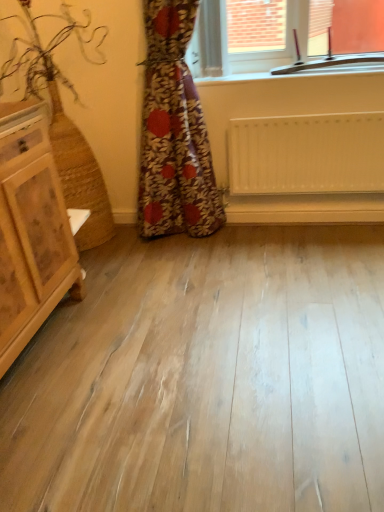
Question: Do you think floral fabric curtain at center is within clear glass window at upper center, or outside of it?

Choices:
 (A) outside
 (B) inside

Answer: (A)

Question: Is floral fabric curtain at center wider or thinner than clear glass window at upper center?

Choices:
 (A) thin
 (B) wide

Answer: (B)

Question: Which object is the closest to the white matte radiator at center?

Choices:
 (A) clear glass window at upper center
 (B) floral fabric curtain at center
 (C) light brown wooden chest of drawers at left

Answer: (B)

Question: Which is farther from the clear glass window at upper center?

Choices:
 (A) white matte radiator at center
 (B) floral fabric curtain at center
 (C) light brown wooden chest of drawers at left

Answer: (C)